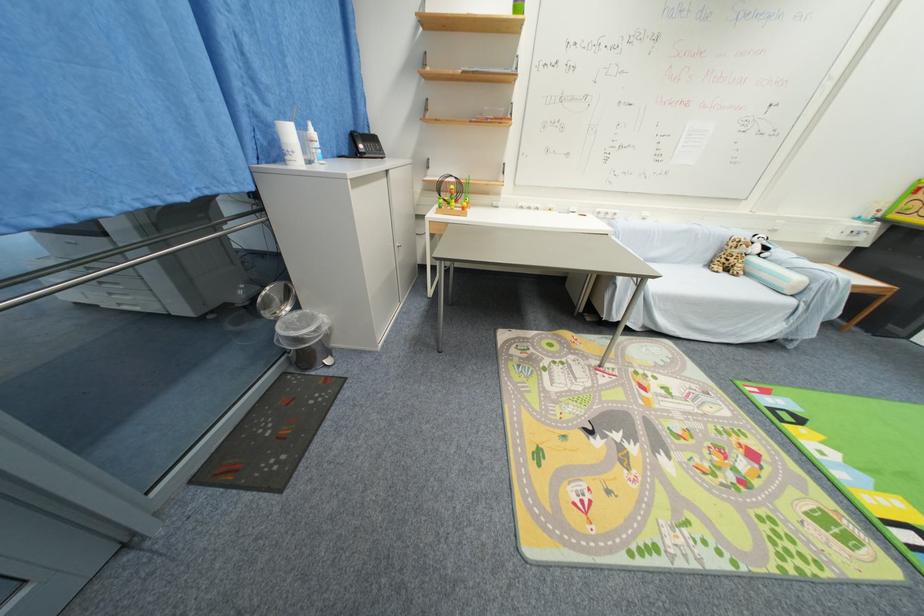
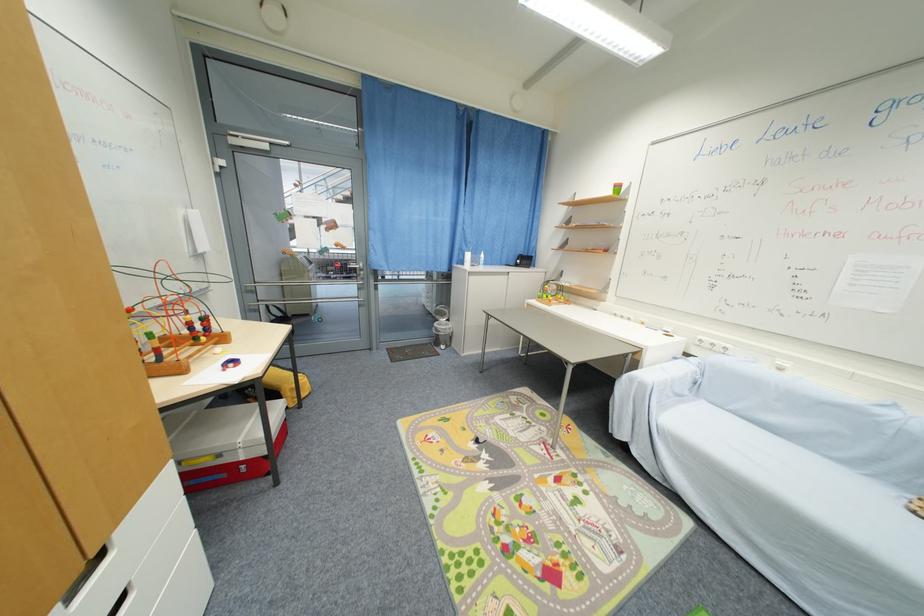
Where in the second image is the point corresponding to (x=603, y=215) from the first image?

(706, 342)